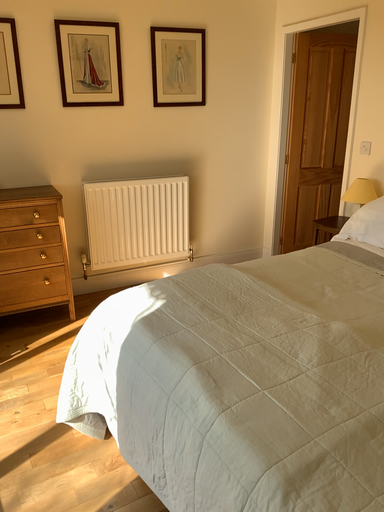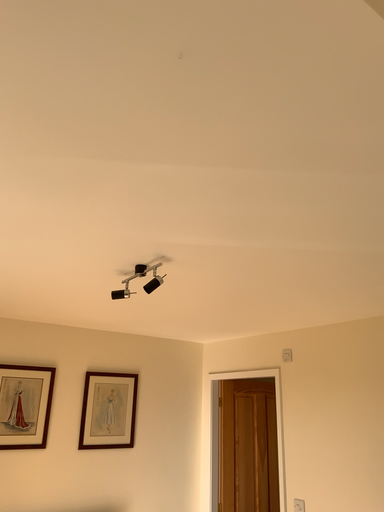
Question: Which way did the camera rotate in the video?

Choices:
 (A) rotated left
 (B) rotated right

Answer: (B)